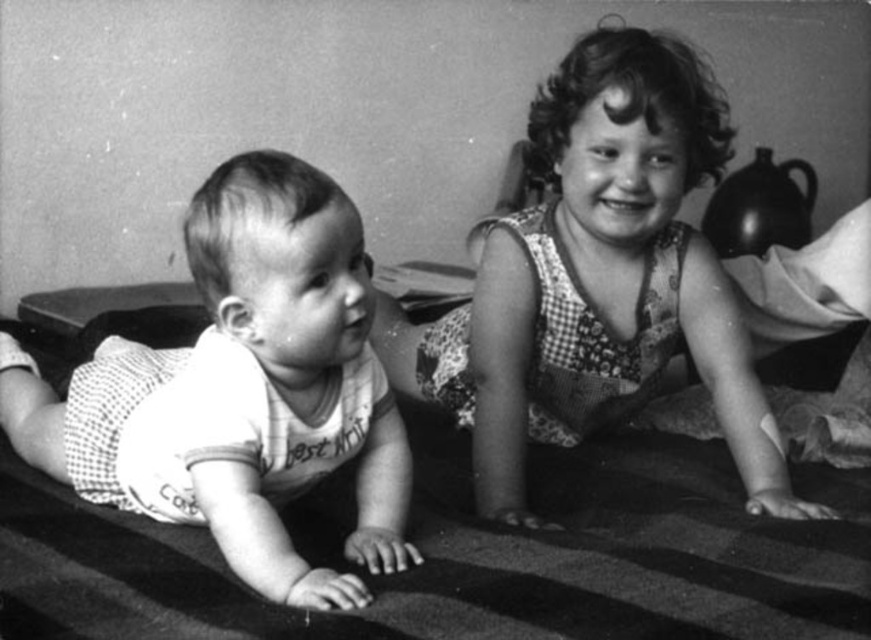
You are a photographer trying to capture a photo of both the checkered fabric dress at upper right and the white dotted fabric baby at left. Which child should you adjust the camera focus on first to ensure both are in frame?

The checkered fabric dress at upper right is much taller than the white dotted fabric baby at left, so you should focus on the taller child first to ensure the shorter one is also in frame.

You are standing in front of the image and want to describe the position of the checkered fabric dress at upper right relative to the striped fabric. Can you tell me where it is located?

The checkered fabric dress at upper right is located at point 0.439 on the x axis and 0.687 on the y axis. Therefore, it is positioned to the right and slightly above the center of the image.

You are a photographer trying to capture a closeup of the checkered fabric dress at upper right without blocking the view of the white dotted fabric baby at left. Is this possible given their positions?

The checkered fabric dress at upper right is located above the white dotted fabric baby at left, so you can position the camera lower to capture the dress while keeping the baby visible below without obstruction.